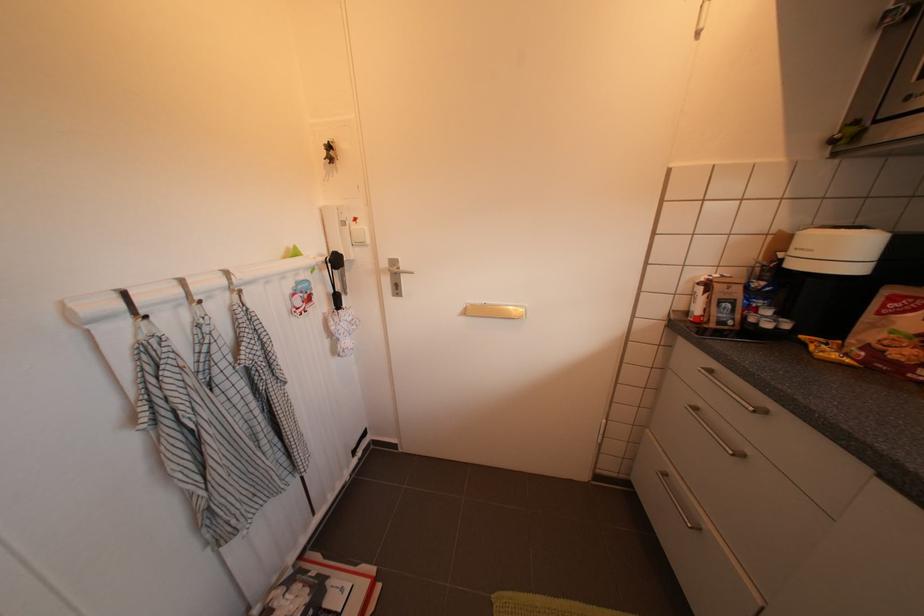
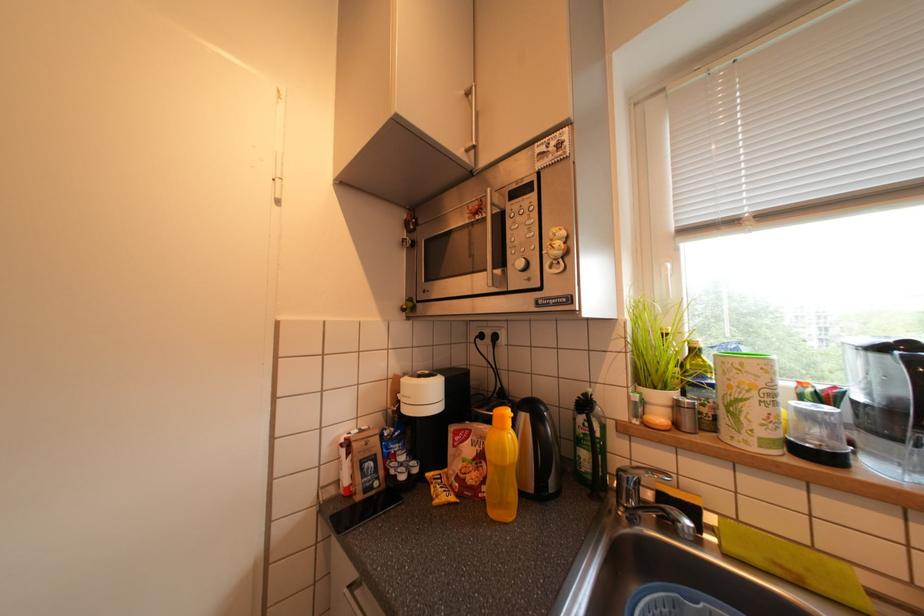
Question: The images are taken continuously from a first-person perspective. In which direction is your viewpoint rotating?

Choices:
 (A) Left
 (B) Right
 (C) Up
 (D) Down

Answer: (B)